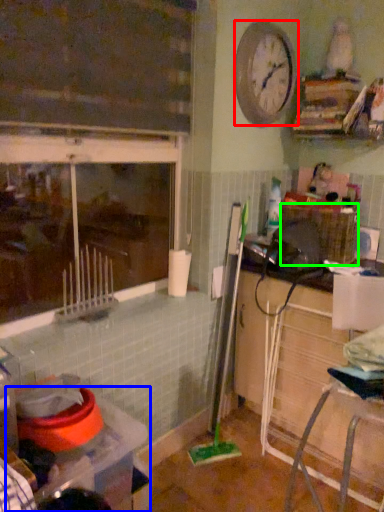
Question: Considering the real-world distances, which object is farthest from clock (highlighted by a red box)? table (highlighted by a blue box) or crate (highlighted by a green box)?

Choices:
 (A) table
 (B) crate

Answer: (A)